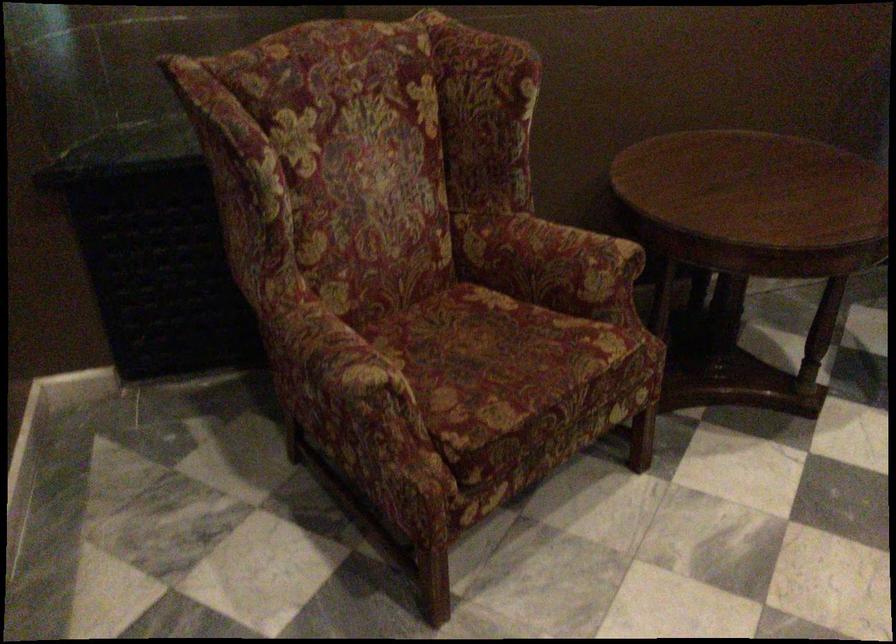
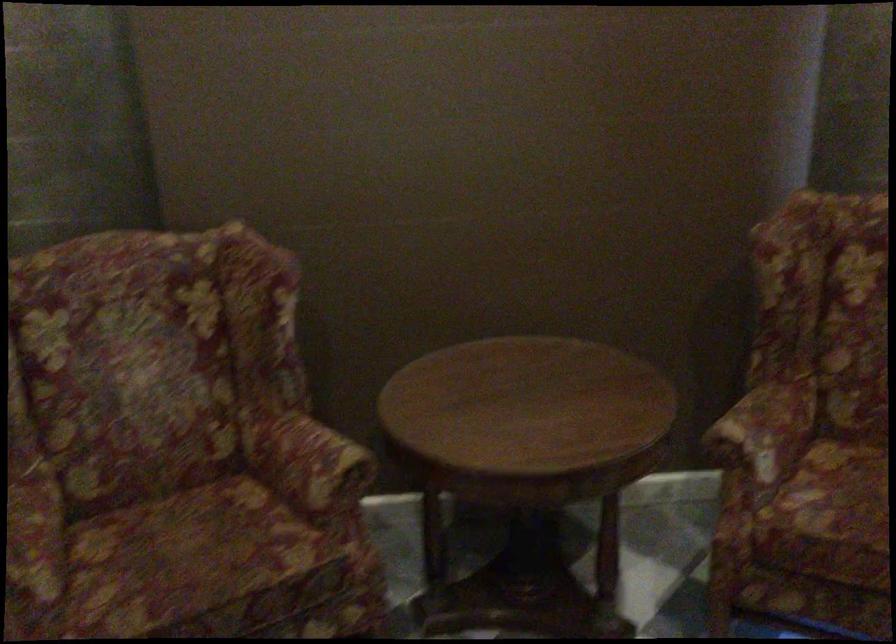
Question: In a continuous first-person perspective shot, in which direction is the camera moving?

Choices:
 (A) Left
 (B) Right
 (C) Forward
 (D) Backward

Answer: (B)